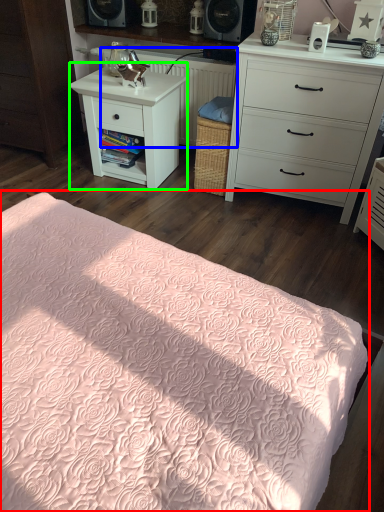
Question: Which object is positioned closest to bed (highlighted by a red box)? Select from radiator (highlighted by a blue box) and nightstand (highlighted by a green box).

Choices:
 (A) radiator
 (B) nightstand

Answer: (B)